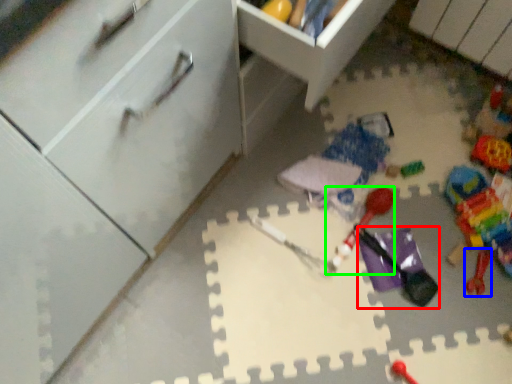
Question: Based on their relative distances, which object is nearer to toy (highlighted by a red box)? Choose from toy (highlighted by a blue box) and toy (highlighted by a green box).

Choices:
 (A) toy
 (B) toy

Answer: (B)